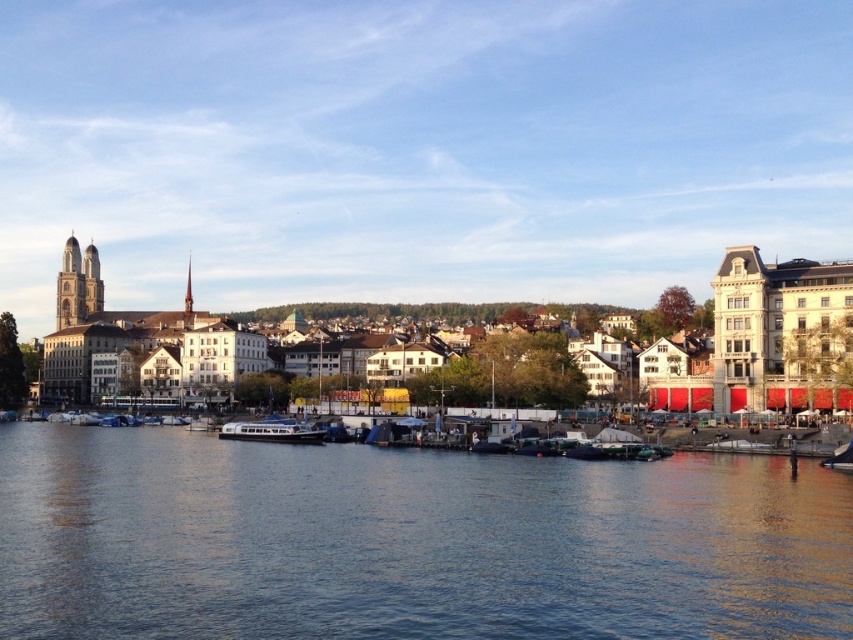
You are a photographer planning to capture the entire blue metallic boat at center in your shot. Given that your camera has a maximum field of view of 1.2 meters, can you determine if the blue water at center will allow you to frame the boat without cropping?

The blue water at center is wider than the blue metallic boat at center, so yes, the boat can be framed without cropping as the water provides sufficient width.

Consider the image. You are a tourist standing at the riverside and want to take a photo of the white matte building at left and the blue water at center. Which object should you frame first in your camera to ensure both are in the shot?

The white matte building at left should be framed first because it is positioned to the left of the blue water at center, allowing both to be captured in the same frame.